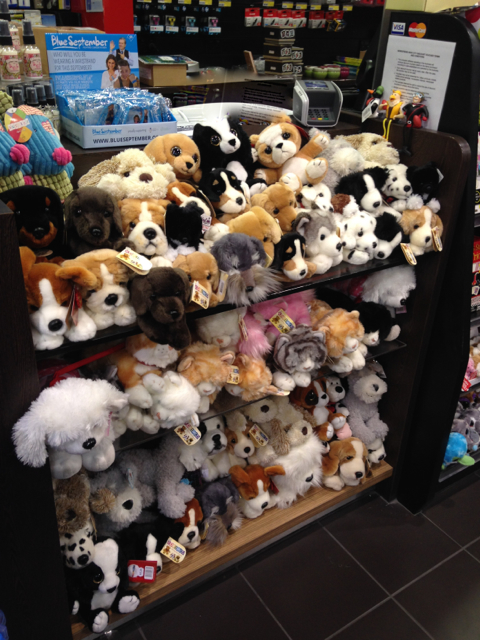
Locate an element on the screen. shelf is located at coordinates (205, 555), (226, 406), (288, 290), (214, 77).